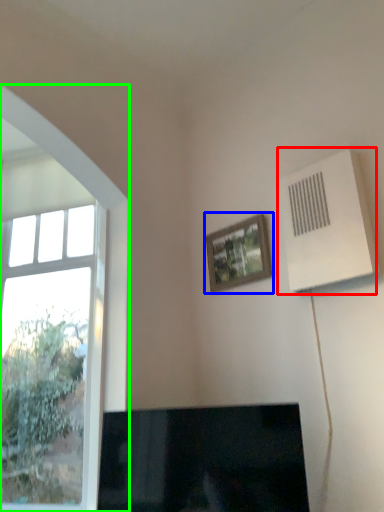
Question: Considering the real-world distances, which object is farthest from air conditioning (highlighted by a red box)? picture frame (highlighted by a blue box) or window (highlighted by a green box)?

Choices:
 (A) picture frame
 (B) window

Answer: (B)